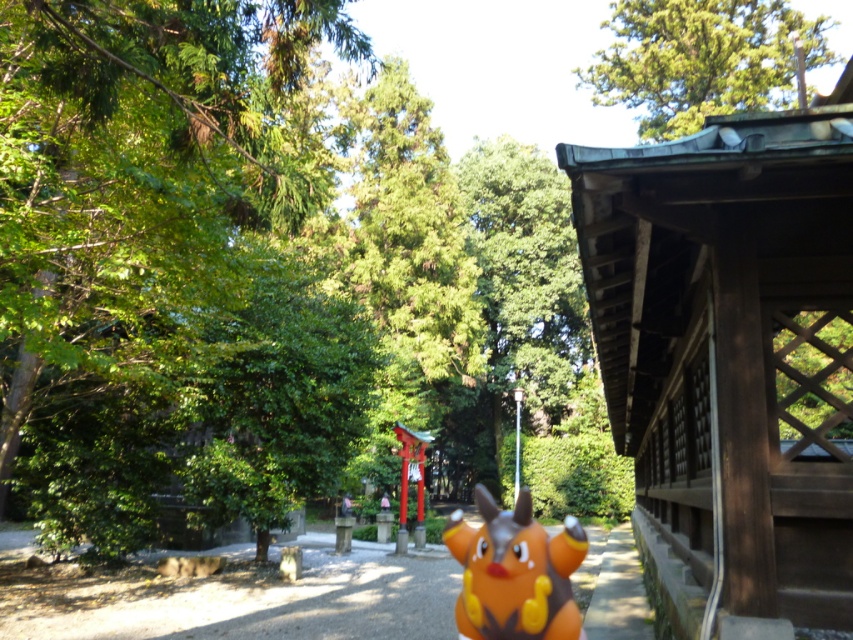
Question: Which object is farther from the camera taking this photo?

Choices:
 (A) orange matte plush at center
 (B) orange plastic toy at center

Answer: (B)

Question: Observing the image, what is the correct spatial positioning of orange plastic toy at center in reference to orange matte plush at center?

Choices:
 (A) below
 (B) above

Answer: (B)

Question: Can you confirm if orange plastic toy at center is positioned below orange matte plush at center?

Choices:
 (A) yes
 (B) no

Answer: (B)

Question: Is orange plastic toy at center below orange matte plush at center?

Choices:
 (A) no
 (B) yes

Answer: (A)

Question: Which point is closer to the camera?

Choices:
 (A) 461,604
 (B) 610,602

Answer: (A)